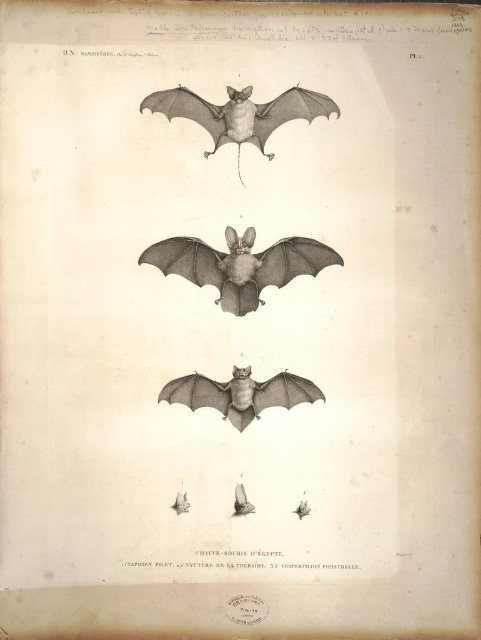
Between matte black wing at center and gray ink bat at center, which one is positioned lower?

gray ink bat at center is lower down.

Is point (182, 257) less distant than point (283, 381)?

Yes, it is.

This screenshot has width=481, height=640. In order to click on matte black wing at center in this screenshot , I will do click(x=240, y=264).

This screenshot has width=481, height=640. I want to click on matte black wing at center, so click(240, 264).